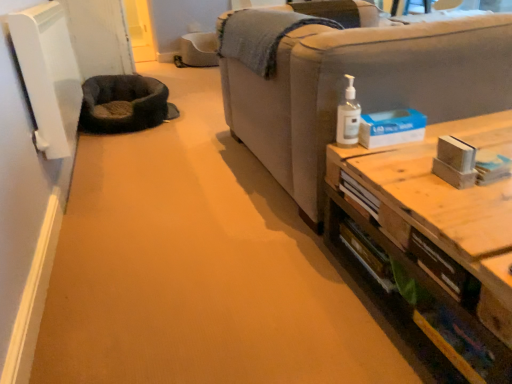
Describe the element at coordinates (362, 88) in the screenshot. I see `light gray fabric couch at right` at that location.

The width and height of the screenshot is (512, 384). I want to click on wooden table at right, so [430, 247].

Could clear plastic pump bottle at upper right be considered to be inside dark gray plush cat bed at left?

No, dark gray plush cat bed at left does not contain clear plastic pump bottle at upper right.

From a real-world perspective, between dark gray plush cat bed at left and clear plastic pump bottle at upper right, who is vertically higher?

In real-world perspective, clear plastic pump bottle at upper right is above.

From the image's perspective, does dark gray plush cat bed at left appear higher than clear plastic pump bottle at upper right?

Yes, from the image's perspective, dark gray plush cat bed at left is on top of clear plastic pump bottle at upper right.

Is dark gray plush cat bed at left positioned far away from clear plastic pump bottle at upper right?

Absolutely, dark gray plush cat bed at left is distant from clear plastic pump bottle at upper right.

Based on the photo, from the image's perspective, which one is positioned lower, clear plastic pump bottle at upper right or dark gray plush cat bed at left?

clear plastic pump bottle at upper right.

From a real-world perspective, is clear plastic pump bottle at upper right beneath dark gray plush cat bed at left?

No, from a real-world perspective, clear plastic pump bottle at upper right is not beneath dark gray plush cat bed at left.

Would you consider clear plastic pump bottle at upper right to be distant from dark gray plush cat bed at left?

Yes.

In the image, is dark gray plush cat bed at left positioned in front of or behind light gray fabric couch at right?

In the image, dark gray plush cat bed at left appears behind light gray fabric couch at right.

Does dark gray plush cat bed at left have a greater width compared to light gray fabric couch at right?

No, dark gray plush cat bed at left is not wider than light gray fabric couch at right.

From a real-world perspective, is dark gray plush cat bed at left below light gray fabric couch at right?

Yes, from a real-world perspective, dark gray plush cat bed at left is under light gray fabric couch at right.

Considering the sizes of objects dark gray plush cat bed at left and light gray fabric couch at right in the image provided, who is smaller, dark gray plush cat bed at left or light gray fabric couch at right?

dark gray plush cat bed at left is smaller.

Is light gray fabric couch at right at the left side of dark gray plush cat bed at left?

No.

Between light gray fabric couch at right and dark gray plush cat bed at left, which one has smaller size?

dark gray plush cat bed at left is smaller.

Which is behind, light gray fabric couch at right or dark gray plush cat bed at left?

dark gray plush cat bed at left is more distant.

In terms of width, does light gray fabric couch at right look wider or thinner when compared to dark gray plush cat bed at left?

light gray fabric couch at right is wider than dark gray plush cat bed at left.

Which object is wider, light gray fabric couch at right or wooden table at right?

Wider between the two is light gray fabric couch at right.

Which of these two, light gray fabric couch at right or wooden table at right, stands taller?

light gray fabric couch at right is taller.

Considering the sizes of objects light gray fabric couch at right and wooden table at right in the image provided, who is smaller, light gray fabric couch at right or wooden table at right?

wooden table at right.

From a real-world perspective, who is located higher, light gray fabric couch at right or wooden table at right?

light gray fabric couch at right is physically above.

From their relative heights in the image, would you say wooden table at right is taller or shorter than light gray fabric couch at right?

Clearly, wooden table at right is shorter compared to light gray fabric couch at right.

Can you confirm if wooden table at right is smaller than light gray fabric couch at right?

Indeed, wooden table at right has a smaller size compared to light gray fabric couch at right.

Considering the positions of point (404, 212) and point (421, 79), is point (404, 212) closer or farther from the camera than point (421, 79)?

Point (404, 212) is positioned closer to the camera compared to point (421, 79).

Would you say wooden table at right is inside or outside light gray fabric couch at right?

The correct answer is: outside.

Which of these two, wooden table at right or clear plastic pump bottle at upper right, is wider?

Wider between the two is wooden table at right.

Does wooden table at right turn towards clear plastic pump bottle at upper right?

No, wooden table at right is not aimed at clear plastic pump bottle at upper right.

Is wooden table at right at the right side of clear plastic pump bottle at upper right?

Correct, you'll find wooden table at right to the right of clear plastic pump bottle at upper right.

Is wooden table at right next to clear plastic pump bottle at upper right?

No, wooden table at right is not with clear plastic pump bottle at upper right.

Find the location of `cat bed above the clear plastic pump bottle at upper right (from the image's perspective)`. cat bed above the clear plastic pump bottle at upper right (from the image's perspective) is located at coordinates (124, 104).

In the image, there is a clear plastic pump bottle at upper right. At what (x,y) coordinates should I click in order to perform the action: click on cat bed below it (from a real-world perspective). Please return your answer as a coordinate pair (x, y). Looking at the image, I should click on (124, 104).

When comparing their distances from clear plastic pump bottle at upper right, does light gray fabric couch at right or dark gray plush cat bed at left seem closer?

light gray fabric couch at right is closer to clear plastic pump bottle at upper right.

When comparing their distances from clear plastic pump bottle at upper right, does wooden table at right or light gray fabric couch at right seem closer?

light gray fabric couch at right lies closer to clear plastic pump bottle at upper right than the other object.

Looking at the image, which one is located closer to dark gray plush cat bed at left, clear plastic pump bottle at upper right or wooden table at right?

clear plastic pump bottle at upper right.

Considering their positions, is dark gray plush cat bed at left positioned further to clear plastic pump bottle at upper right than wooden table at right?

dark gray plush cat bed at left is positioned further to the anchor clear plastic pump bottle at upper right.

Which object lies nearer to the anchor point dark gray plush cat bed at left, wooden table at right or light gray fabric couch at right?

light gray fabric couch at right is closer to dark gray plush cat bed at left.

From the image, which object appears to be farther from dark gray plush cat bed at left, light gray fabric couch at right or wooden table at right?

wooden table at right is further to dark gray plush cat bed at left.

When comparing their distances from wooden table at right, does dark gray plush cat bed at left or light gray fabric couch at right seem further?

dark gray plush cat bed at left.

Looking at the image, which one is located closer to light gray fabric couch at right, dark gray plush cat bed at left or clear plastic pump bottle at upper right?

Based on the image, clear plastic pump bottle at upper right appears to be nearer to light gray fabric couch at right.

Image resolution: width=512 pixels, height=384 pixels. What are the coordinates of `toiletry between light gray fabric couch at right and dark gray plush cat bed at left along the z-axis` in the screenshot? It's located at (348, 116).

Where is `toiletry located between wooden table at right and dark gray plush cat bed at left in the depth direction`? toiletry located between wooden table at right and dark gray plush cat bed at left in the depth direction is located at coordinates (348, 116).

What are the coordinates of `toiletry that lies between light gray fabric couch at right and wooden table at right from top to bottom` in the screenshot? It's located at (348, 116).

Identify the location of studio couch between wooden table at right and dark gray plush cat bed at left in the front-back direction. This screenshot has width=512, height=384. (362, 88).